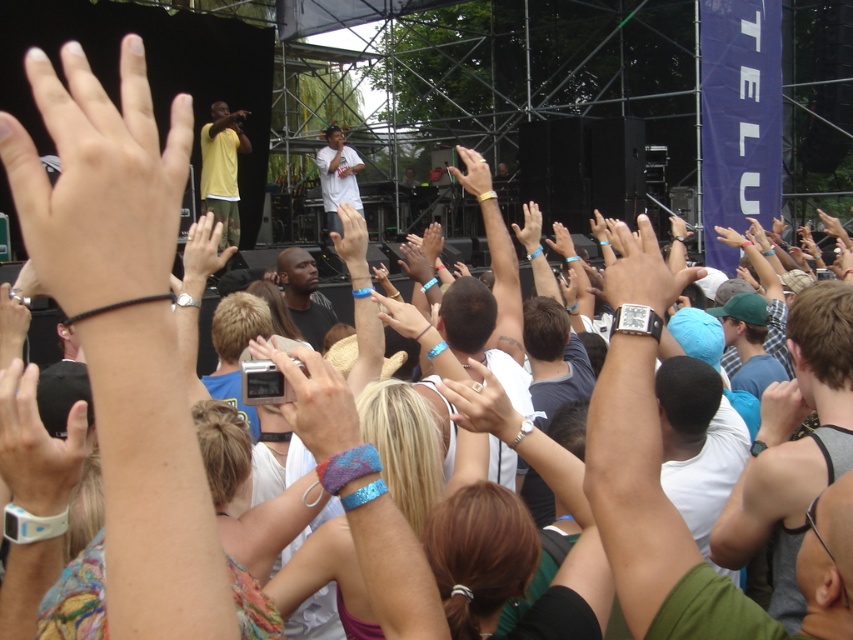
Question: From the image, what is the correct spatial relationship of smooth skin hand at center in relation to matte black wristband at upper center?

Choices:
 (A) above
 (B) below

Answer: (B)

Question: Is white matte hand at upper left closer to camera compared to matte black wristband at upper center?

Choices:
 (A) yes
 (B) no

Answer: (A)

Question: Estimate the real-world distances between objects in this image. Which object is farther from the silver metallic camera at center?

Choices:
 (A) smooth skin hand at center
 (B) white matte hand at upper left
 (C) matte black hand at upper center
 (D) matte black wristband at upper center

Answer: (D)

Question: Which object appears farthest from the camera in this image?

Choices:
 (A) matte black wristband at upper center
 (B) white matte hand at upper left
 (C) smooth skin hand at center

Answer: (A)

Question: Does white matte hand at upper left have a larger size compared to silver metallic camera at center?

Choices:
 (A) no
 (B) yes

Answer: (B)

Question: Which of the following is the closest to the observer?

Choices:
 (A) (67, 44)
 (B) (355, 211)

Answer: (A)